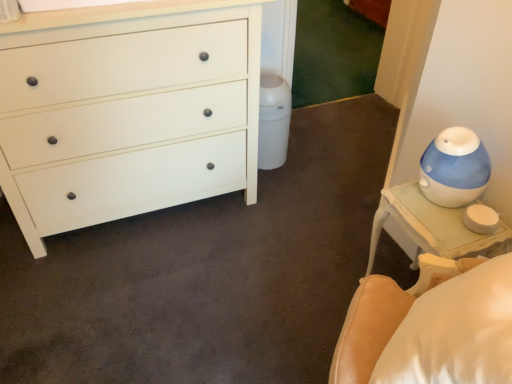
Find the location of a particular element. vacant space in between white glossy nightstand at right and white matte chest of drawers at left is located at coordinates (242, 252).